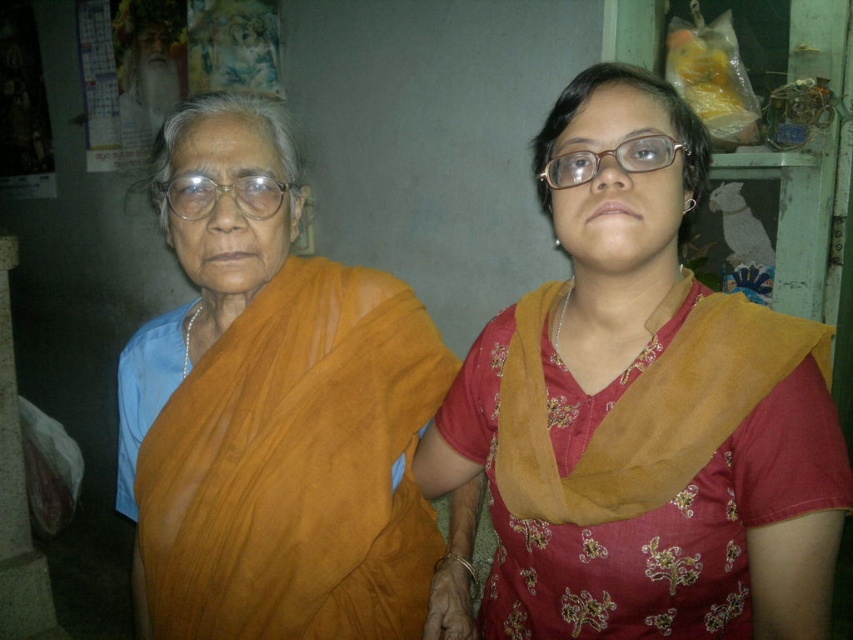
Question: Observing the image, what is the correct spatial positioning of orange fabric sari at left in reference to matte plastic glasses at left?

Choices:
 (A) left
 (B) right

Answer: (B)

Question: Which point appears farthest from the camera in this image?

Choices:
 (A) (584, 365)
 (B) (178, 205)

Answer: (B)

Question: Which point is farther to the camera?

Choices:
 (A) orange fabric sari at left
 (B) matte orange scarf at center
 (C) matte plastic glasses at center
 (D) matte plastic glasses at left

Answer: (D)

Question: Can you confirm if matte orange scarf at center is positioned to the left of matte plastic glasses at center?

Choices:
 (A) yes
 (B) no

Answer: (B)

Question: Among these points, which one is nearest to the camera?

Choices:
 (A) (286, 186)
 (B) (569, 522)

Answer: (B)

Question: From the image, what is the correct spatial relationship of matte plastic glasses at left in relation to matte plastic glasses at center?

Choices:
 (A) left
 (B) right

Answer: (A)